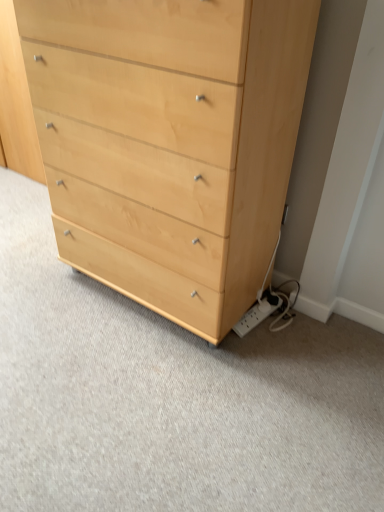
This screenshot has width=384, height=512. Describe the element at coordinates (169, 141) in the screenshot. I see `light wood chest of drawers at center` at that location.

What is the approximate width of light wood chest of drawers at center?

18.13 inches.

Locate an element on the screen. light wood chest of drawers at center is located at coordinates (169, 141).

The width and height of the screenshot is (384, 512). What are the coordinates of `white plastic power strip at lower right` in the screenshot? It's located at (258, 313).

Describe the element at coordinates (258, 313) in the screenshot. I see `white plastic power strip at lower right` at that location.

This screenshot has width=384, height=512. In order to click on light wood chest of drawers at center in this screenshot , I will do 169,141.

Can you confirm if light wood chest of drawers at center is positioned to the right of white plastic power strip at lower right?

Incorrect, light wood chest of drawers at center is not on the right side of white plastic power strip at lower right.

Between light wood chest of drawers at center and white plastic power strip at lower right, which one is positioned in front?

light wood chest of drawers at center is more forward.

Considering the positions of point (178, 105) and point (258, 307), is point (178, 105) closer or farther from the camera than point (258, 307)?

Point (178, 105) is positioned closer to the camera compared to point (258, 307).

From the image's perspective, which is above, light wood chest of drawers at center or white plastic power strip at lower right?

light wood chest of drawers at center is shown above in the image.

Consider the image. From a real-world perspective, is light wood chest of drawers at center positioned under white plastic power strip at lower right based on gravity?

Incorrect, from a real-world perspective, light wood chest of drawers at center is higher than white plastic power strip at lower right.

Based on the photo, can you confirm if light wood chest of drawers at center is wider than white plastic power strip at lower right?

Correct, the width of light wood chest of drawers at center exceeds that of white plastic power strip at lower right.

Which of these two, light wood chest of drawers at center or white plastic power strip at lower right, stands shorter?

white plastic power strip at lower right is shorter.

Is light wood chest of drawers at center bigger than white plastic power strip at lower right?

Correct, light wood chest of drawers at center is larger in size than white plastic power strip at lower right.

Is light wood chest of drawers at center surrounding white plastic power strip at lower right?

No, white plastic power strip at lower right is not a part of light wood chest of drawers at center.

Would you consider light wood chest of drawers at center to be distant from white plastic power strip at lower right?

No, light wood chest of drawers at center is not far from white plastic power strip at lower right.

Is light wood chest of drawers at center oriented towards white plastic power strip at lower right?

No.

How far apart are light wood chest of drawers at center and white plastic power strip at lower right?

light wood chest of drawers at center is 28.32 inches away from white plastic power strip at lower right.

Find the location of a particular element. The height and width of the screenshot is (512, 384). the chest of drawers above the white plastic power strip at lower right (from the image's perspective) is located at coordinates (169, 141).

Considering the positions of objects white plastic power strip at lower right and light wood chest of drawers at center in the image provided, who is more to the right, white plastic power strip at lower right or light wood chest of drawers at center?

white plastic power strip at lower right.

Considering the relative positions of white plastic power strip at lower right and light wood chest of drawers at center in the image provided, is white plastic power strip at lower right in front of light wood chest of drawers at center?

No, it is not.

Is point (256, 324) in front of point (245, 157)?

No, it is not.

From the image's perspective, relative to light wood chest of drawers at center, is white plastic power strip at lower right above or below?

From the image's perspective, white plastic power strip at lower right appears below light wood chest of drawers at center.

From a real-world perspective, is white plastic power strip at lower right below light wood chest of drawers at center?

Yes.

In terms of width, does white plastic power strip at lower right look wider or thinner when compared to light wood chest of drawers at center?

white plastic power strip at lower right is thinner than light wood chest of drawers at center.

Is white plastic power strip at lower right shorter than light wood chest of drawers at center?

Indeed, white plastic power strip at lower right has a lesser height compared to light wood chest of drawers at center.

Is white plastic power strip at lower right bigger or smaller than light wood chest of drawers at center?

Clearly, white plastic power strip at lower right is smaller in size than light wood chest of drawers at center.

Would you say white plastic power strip at lower right contains light wood chest of drawers at center?

Definitely not — light wood chest of drawers at center is not inside white plastic power strip at lower right.

Is white plastic power strip at lower right far away from light wood chest of drawers at center?

That's not correct — white plastic power strip at lower right is a little close to light wood chest of drawers at center.

Is white plastic power strip at lower right looking in the opposite direction of light wood chest of drawers at center?

No.

How many degrees apart are the facing directions of white plastic power strip at lower right and light wood chest of drawers at center?

10.7 degrees separate the facing orientations of white plastic power strip at lower right and light wood chest of drawers at center.

At what (x,y) coordinates should I click in order to perform the action: click on electric outlet on the right of light wood chest of drawers at center. Please return your answer as a coordinate pair (x, y). Looking at the image, I should click on (x=258, y=313).

Where is `electric outlet that appears on the right of light wood chest of drawers at center`? The width and height of the screenshot is (384, 512). electric outlet that appears on the right of light wood chest of drawers at center is located at coordinates (258, 313).

Where is `electric outlet lying below the light wood chest of drawers at center (from the image's perspective)`? Image resolution: width=384 pixels, height=512 pixels. electric outlet lying below the light wood chest of drawers at center (from the image's perspective) is located at coordinates (258, 313).